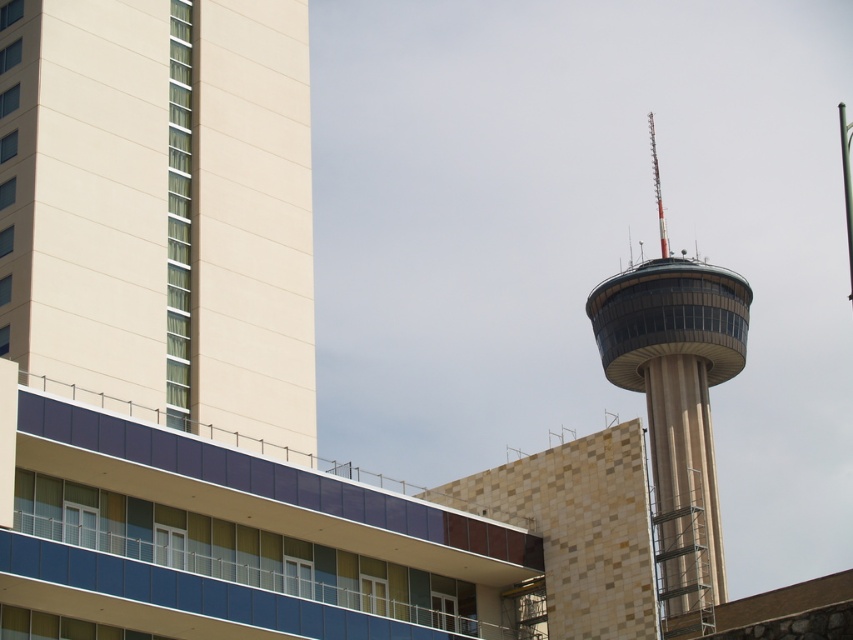
Question: Is beige concrete tower at left to the left of beige stone tower at right from the viewer's perspective?

Choices:
 (A) yes
 (B) no

Answer: (A)

Question: Which object is farther from the camera taking this photo?

Choices:
 (A) beige stone tower at right
 (B) beige concrete tower at left

Answer: (A)

Question: Which object is farther from the camera taking this photo?

Choices:
 (A) beige concrete tower at left
 (B) beige stone tower at right

Answer: (B)

Question: Can you confirm if beige concrete tower at left is positioned to the right of beige stone tower at right?

Choices:
 (A) no
 (B) yes

Answer: (A)

Question: Does beige concrete tower at left have a greater width compared to beige stone tower at right?

Choices:
 (A) yes
 (B) no

Answer: (B)